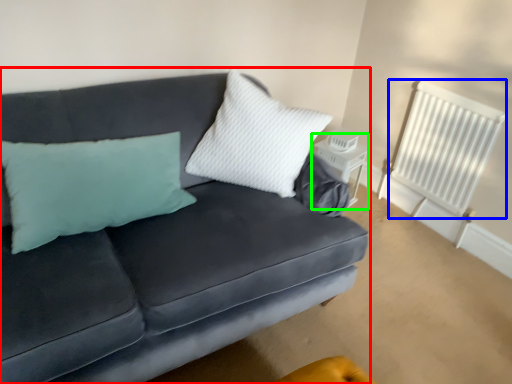
Question: Which object is the farthest from studio couch (highlighted by a red box)? Choose among these: radiator (highlighted by a blue box) or table (highlighted by a green box).

Choices:
 (A) radiator
 (B) table

Answer: (A)